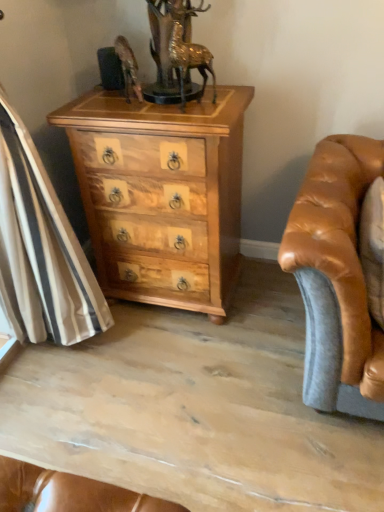
Where is `free location in front of natural wood chest of drawers at center`? The width and height of the screenshot is (384, 512). free location in front of natural wood chest of drawers at center is located at coordinates (171, 369).